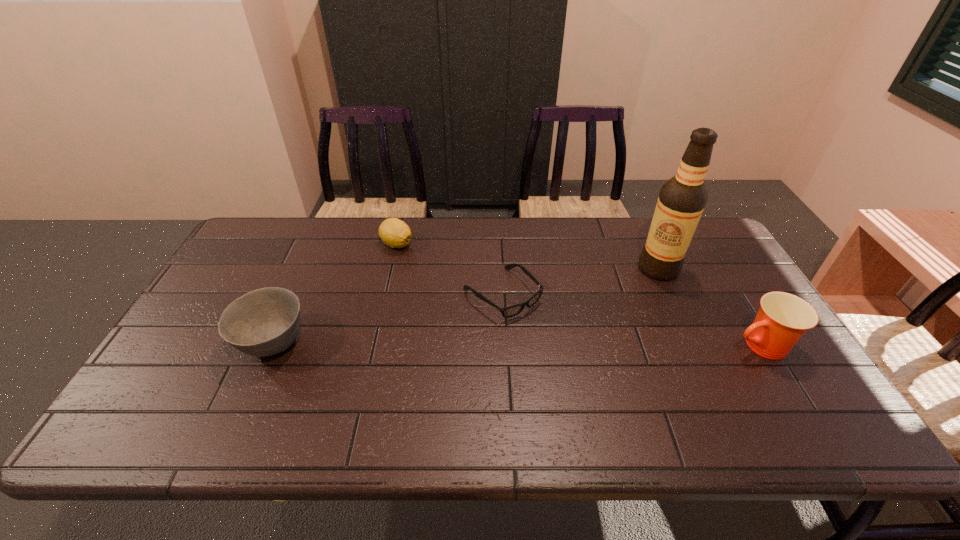
At what (x,y) coordinates should I click in order to perform the action: click on free space on the desktop that is between the leftmost object and the rightmost object and is positioned on the label of the tallest object. Please return your answer as a coordinate pair (x, y). This screenshot has width=960, height=540. Looking at the image, I should click on (501, 345).

Locate an element on the screen. free spot on the desktop that is between the third tallest object and the fourth shortest object and is positioned on the front-facing side of the shortest object is located at coordinates (557, 345).

The height and width of the screenshot is (540, 960). What are the coordinates of `vacant space on the desktop that is between the bowl and the cup and is positioned at the stem end of the second shortest object` in the screenshot? It's located at (459, 344).